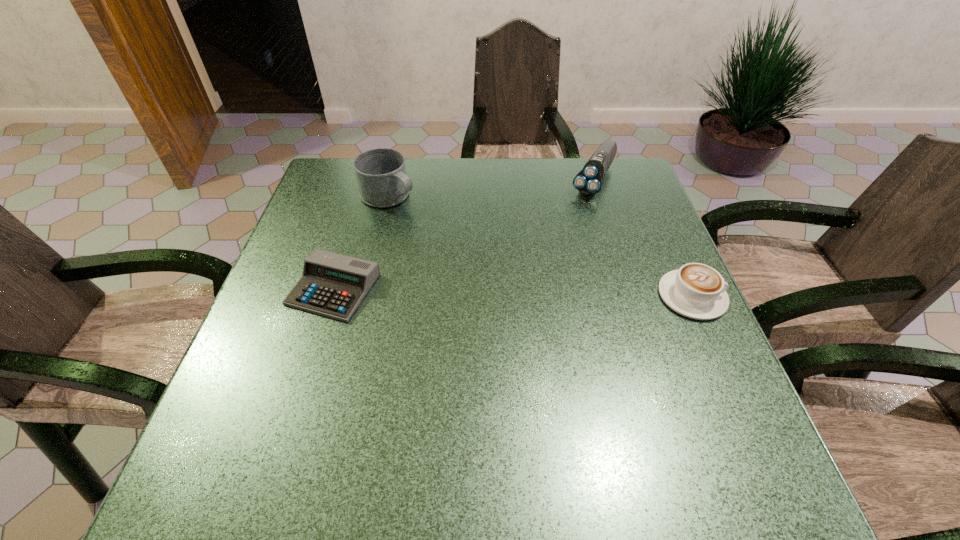
Identify the location of free space located on the head of the third shortest object. This screenshot has width=960, height=540. (559, 246).

I want to click on mug that is at the far edge, so click(x=381, y=174).

Find the location of a particular element. The width and height of the screenshot is (960, 540). electric shaver that is positioned at the far edge is located at coordinates 588,181.

Find the location of `calculator that is at the left edge`. calculator that is at the left edge is located at coordinates (333, 285).

Where is `mug situated at the left edge`? mug situated at the left edge is located at coordinates (381, 174).

The width and height of the screenshot is (960, 540). I want to click on cappuccino present at the right edge, so click(697, 291).

Locate an element on the screen. This screenshot has height=540, width=960. electric shaver that is at the right edge is located at coordinates (588, 181).

At what (x,y) coordinates should I click in order to perform the action: click on object present at the far left corner. Please return your answer as a coordinate pair (x, y). The image size is (960, 540). Looking at the image, I should click on (381, 174).

The image size is (960, 540). Find the location of `object present at the far right corner`. object present at the far right corner is located at coordinates (588, 181).

The width and height of the screenshot is (960, 540). Find the location of `vacant space at the far edge of the desktop`. vacant space at the far edge of the desktop is located at coordinates point(480,191).